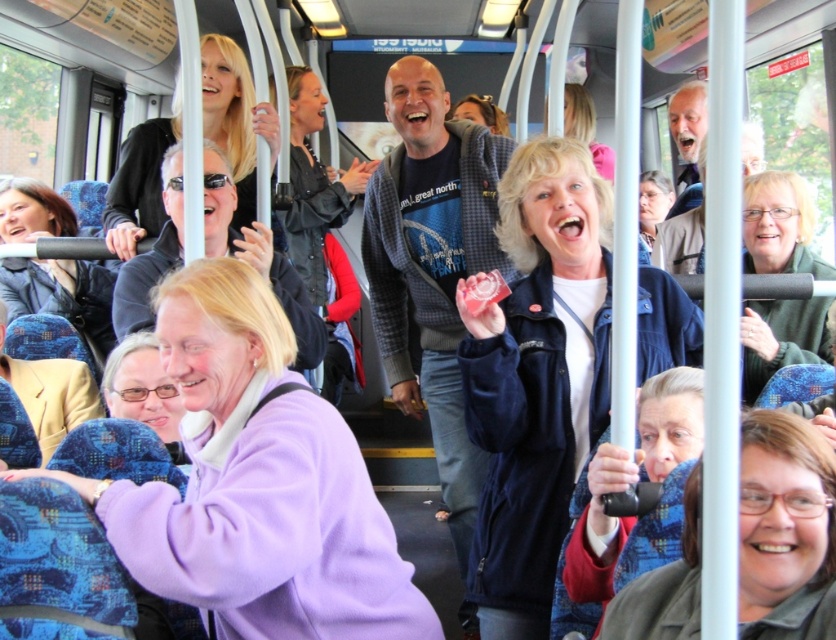
Who is more distant from viewer, (390, 385) or (149, 328)?

Point (390, 385)

Is matte blue cardigan at center further to camera compared to purple fleece jacket at lower left?

Yes, matte blue cardigan at center is behind purple fleece jacket at lower left.

Does point (462, 509) come closer to viewer compared to point (298, 320)?

No, (462, 509) is further to viewer.

At what (x,y) coordinates should I click in order to perform the action: click on matte blue cardigan at center. Please return your answer as a coordinate pair (x, y). The height and width of the screenshot is (640, 836). Looking at the image, I should click on (431, 266).

Does matte blue cardigan at center have a larger size compared to matte black camera at lower right?

Correct, matte blue cardigan at center is larger in size than matte black camera at lower right.

Who is shorter, matte blue cardigan at center or matte black camera at lower right?

With less height is matte black camera at lower right.

The height and width of the screenshot is (640, 836). In order to click on matte blue cardigan at center in this screenshot , I will do `click(431, 266)`.

Does matte black camera at lower right appear on the right side of purple fleece jacket at lower left?

Yes, matte black camera at lower right is to the right of purple fleece jacket at lower left.

Is matte black camera at lower right taller than purple fleece jacket at lower left?

No.

This screenshot has width=836, height=640. In order to click on matte black camera at lower right in this screenshot , I will do tap(784, 529).